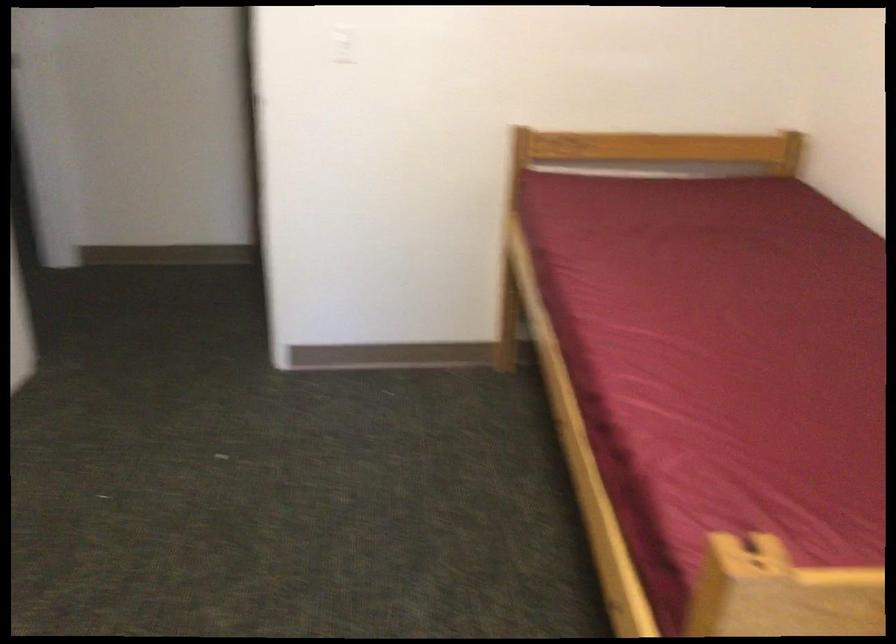
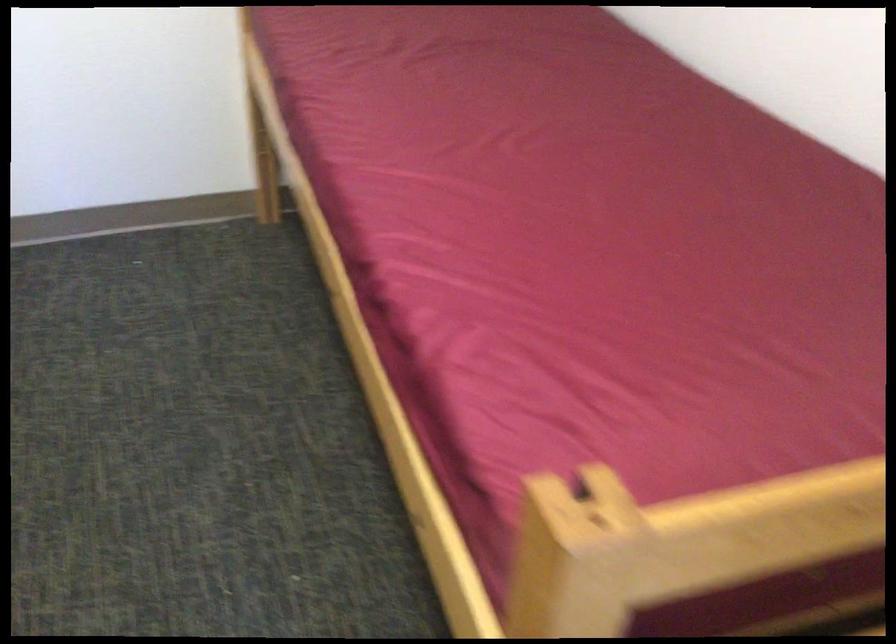
Question: Based on the continuous images, in which direction is the camera rotating? Reply with the corresponding letter.

Choices:
 (A) Left
 (B) Right
 (C) Up
 (D) Down

Answer: (B)